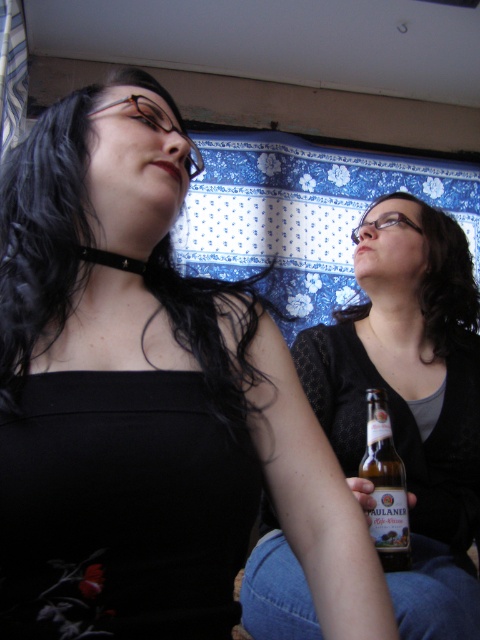
You are a photographer setting up for a portrait. You notice the matte black hair at upper right and the golden glass beer bottle at center. Which object is positioned higher in the frame?

The matte black hair at upper right is located above the golden glass beer bottle at center, so it is positioned higher in the frame.

You are a photographer adjusting your camera settings to capture a clear shot of the matte black shirt at center and the golden glass beer bottle at center. Which object should you focus on first to ensure both are in focus?

The matte black shirt at center is closer to the viewer than the golden glass beer bottle at center, so you should focus on the matte black shirt at center first to ensure both are in focus.